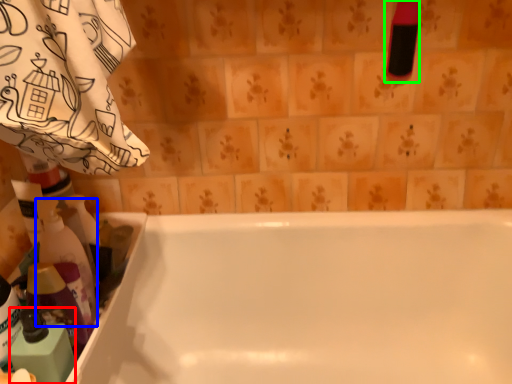
Question: Based on their relative distances, which object is nearer to cleaning product (highlighted by a red box)? Choose from cleaning product (highlighted by a blue box) and cleaning product (highlighted by a green box).

Choices:
 (A) cleaning product
 (B) cleaning product

Answer: (A)